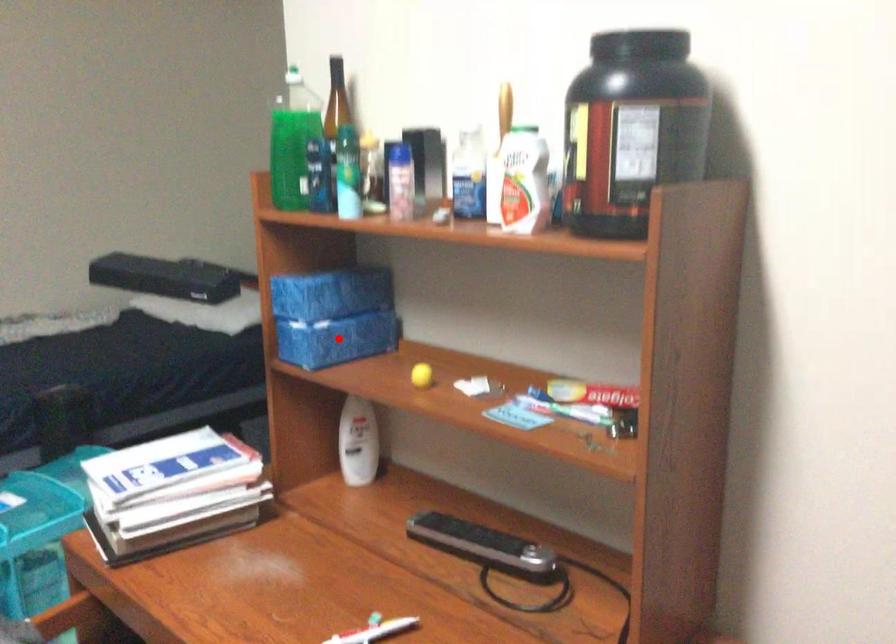
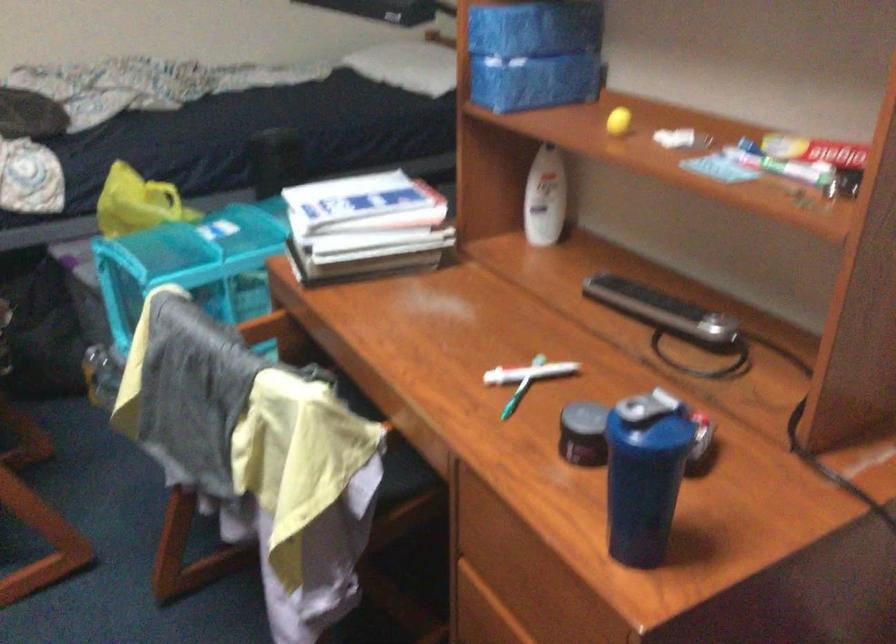
Locate, in the second image, the point that corresponds to the highlighted location in the first image.

(533, 82)